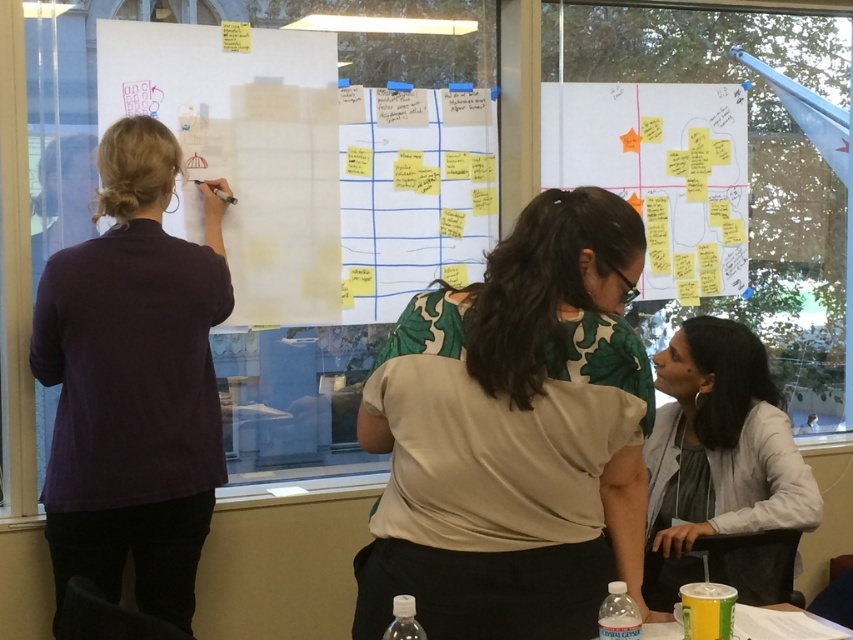
Does white matte whiteboard at left have a lesser height compared to gray fabric shirt at lower right?

Incorrect, white matte whiteboard at left's height does not fall short of gray fabric shirt at lower right's.

Which is behind, point (305, 74) or point (668, 560)?

The point (305, 74) is behind.

This screenshot has width=853, height=640. What do you see at coordinates (244, 150) in the screenshot?
I see `white matte whiteboard at left` at bounding box center [244, 150].

Where is `white matte whiteboard at left`? This screenshot has width=853, height=640. white matte whiteboard at left is located at coordinates (244, 150).

Is white matte whiteboard at left below white matte paperboard at upper center?

Yes, white matte whiteboard at left is below white matte paperboard at upper center.

Which of these two, white matte whiteboard at left or white matte paperboard at upper center, stands taller?

With more height is white matte whiteboard at left.

Does point (248, 68) lie behind point (660, 200)?

No, (248, 68) is in front of (660, 200).

Locate an element on the screen. This screenshot has height=640, width=853. white matte whiteboard at left is located at coordinates (244, 150).

Between white matte paperboard at upper center and yellow sticky notes at center, which one appears on the left side from the viewer's perspective?

yellow sticky notes at center is more to the left.

Does point (691, 141) come behind point (480, 196)?

Yes, point (691, 141) is behind point (480, 196).

This screenshot has height=640, width=853. I want to click on white matte paperboard at upper center, so click(660, 172).